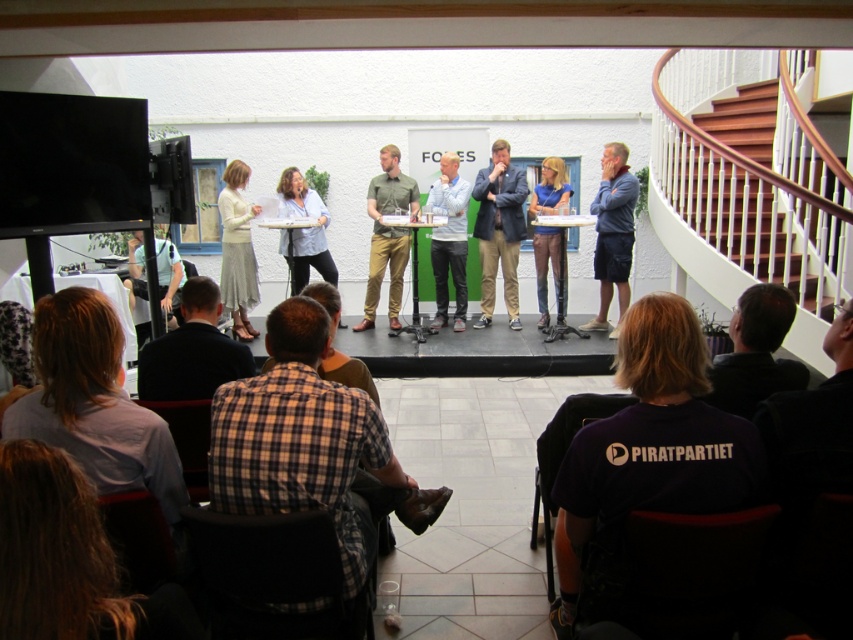
Who is higher up, dark gray sweater at lower right or matte blue shirt at center?

Positioned higher is matte blue shirt at center.

The image size is (853, 640). What do you see at coordinates (755, 353) in the screenshot?
I see `dark gray sweater at lower right` at bounding box center [755, 353].

You are a GUI agent. You are given a task and a screenshot of the screen. Output one action in this format:
    pyautogui.click(x=<x>, y=<y>)
    Task: Click on the dark gray sweater at lower right
    This screenshot has height=640, width=853.
    Given the screenshot: What is the action you would take?
    (x=755, y=353)

Is point (554, 168) positioned behind point (137, 273)?

Yes, point (554, 168) is farther from viewer.

Between point (544, 305) and point (177, 321), which one is positioned behind?

Positioned behind is point (544, 305).

Who is more forward, (x=553, y=188) or (x=136, y=268)?

Point (x=136, y=268) is more forward.

The image size is (853, 640). In order to click on blue denim jeans at center in this screenshot , I will do `click(546, 268)`.

Does dark brown leather jacket at lower right have a lesser width compared to blue denim shorts at right?

No.

Does point (798, 472) lie behind point (596, 200)?

No, (798, 472) is in front of (596, 200).

This screenshot has height=640, width=853. I want to click on dark brown leather jacket at lower right, so click(813, 424).